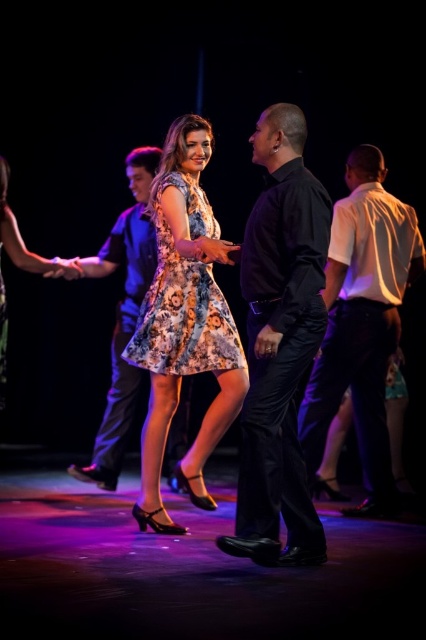
Is the position of white cotton shirt at right more distant than that of floral-patterned fabric dress at center?

Yes, it is.

Between point (371, 152) and point (169, 272), which one is positioned in front?

Point (169, 272) is in front.

The height and width of the screenshot is (640, 426). I want to click on white cotton shirt at right, so click(362, 323).

Looking at this image, does floral-patterned fabric dress at center come behind matte black shirt at center?

No.

Identify the location of floral-patterned fabric dress at center. This screenshot has width=426, height=640. (184, 300).

Between black satin shirt at center and white cotton shirt at right, which one is positioned lower?

black satin shirt at center

Does black satin shirt at center appear under white cotton shirt at right?

Correct, black satin shirt at center is located below white cotton shirt at right.

The image size is (426, 640). What do you see at coordinates (279, 342) in the screenshot?
I see `black satin shirt at center` at bounding box center [279, 342].

Where is `black satin shirt at center`? The height and width of the screenshot is (640, 426). black satin shirt at center is located at coordinates (279, 342).